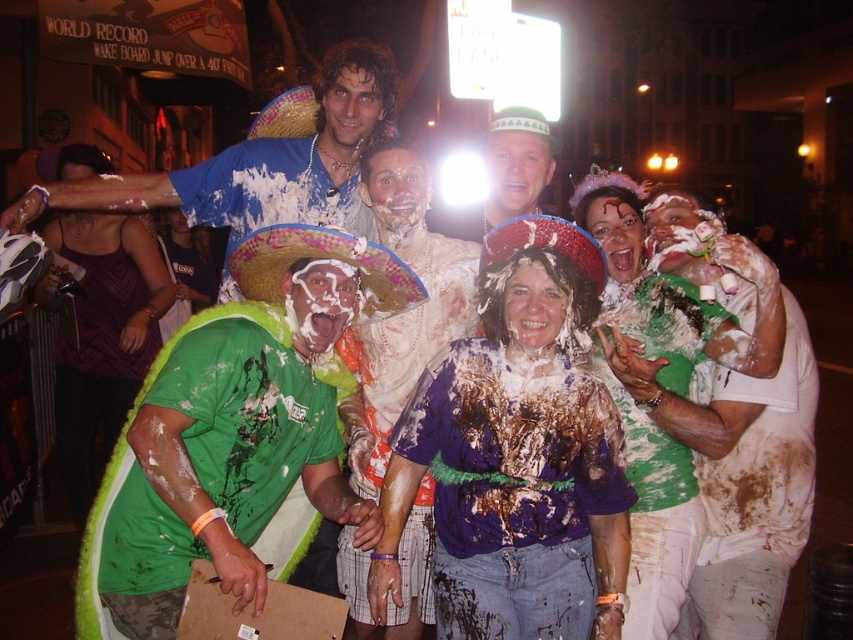
Question: Which point is closer to the camera taking this photo?

Choices:
 (A) (407, 291)
 (B) (341, 548)

Answer: (A)

Question: Which object is positioned farthest from the green fuzzy sombrero at left?

Choices:
 (A) matte green sombrero at center
 (B) purple fabric sombrero at center
 (C) straw woven sombrero at upper center

Answer: (A)

Question: Does white frosted cake at center appear over straw woven sombrero at upper center?

Choices:
 (A) no
 (B) yes

Answer: (A)

Question: Estimate the real-world distances between objects in this image. Which object is closer to the green fuzzy sombrero at left?

Choices:
 (A) purple fabric sombrero at center
 (B) green straw sombrero at center
 (C) matte green sombrero at center
 (D) white frosted cake at center

Answer: (D)

Question: Is dirty purple shirt at center positioned in front of white painted shirt at center?

Choices:
 (A) yes
 (B) no

Answer: (B)

Question: Does green fuzzy sombrero at left have a greater width compared to matte green sombrero at center?

Choices:
 (A) no
 (B) yes

Answer: (B)